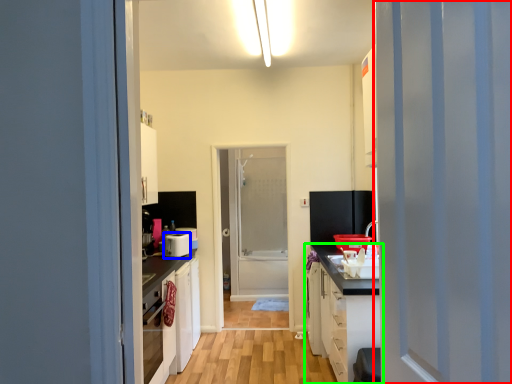
Question: Which object is the closest to the door (highlighted by a red box)? Choose among these: appliance (highlighted by a blue box) or cabinetry (highlighted by a green box).

Choices:
 (A) appliance
 (B) cabinetry

Answer: (B)